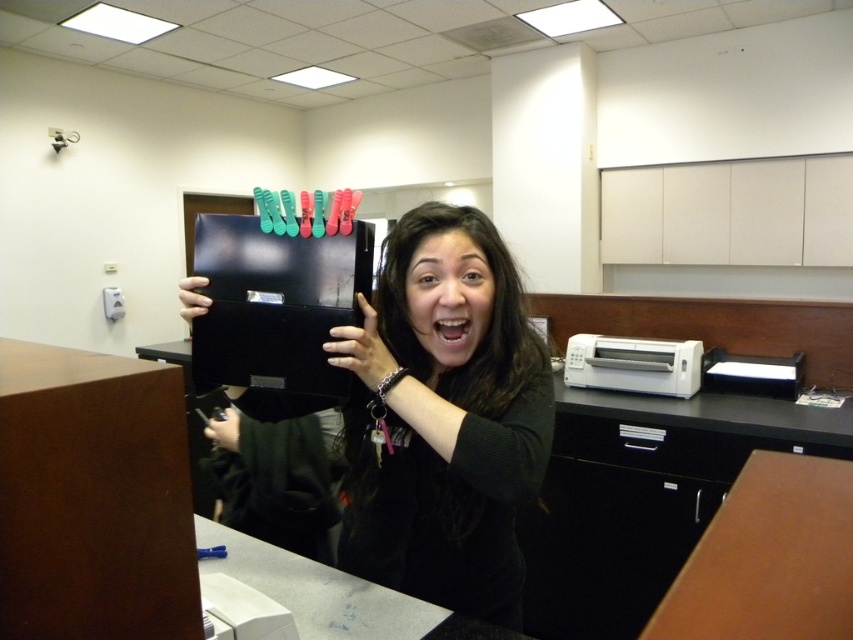
You are an office worker who needs to place a new document organizer on the desk. The document organizer requires a flat surface that is at least 20 cm higher than the black matte file cabinet at lower right. Can the brown wood table at lower right provide a suitable surface for this?

The black matte file cabinet at lower right is located below the brown wood table at lower right, meaning the table is higher than the cabinet. Since the document organizer needs a surface at least 20 cm higher, the brown wood table at lower right is suitable as it meets the height requirement.

You need to place the matte black folder at center onto the brown wood table at lower right. Based on their sizes, will the folder fit on the table?

The matte black folder at center is narrower than the brown wood table at lower right, so it should fit on the table.